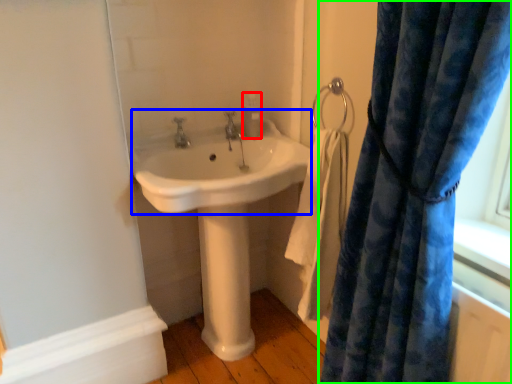
Question: Which object is the closest to the soap dispenser (highlighted by a red box)? Choose among these: sink (highlighted by a blue box) or curtain (highlighted by a green box).

Choices:
 (A) sink
 (B) curtain

Answer: (A)